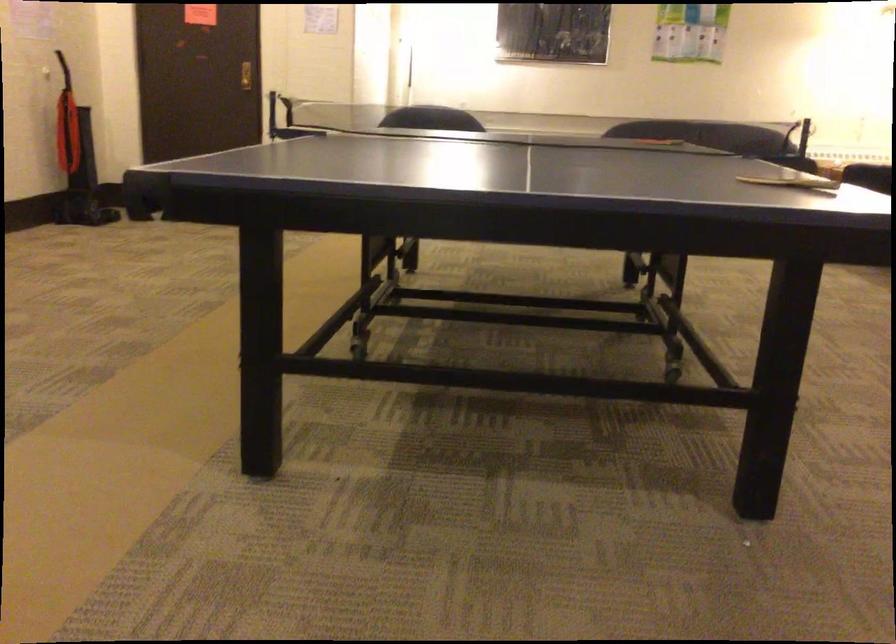
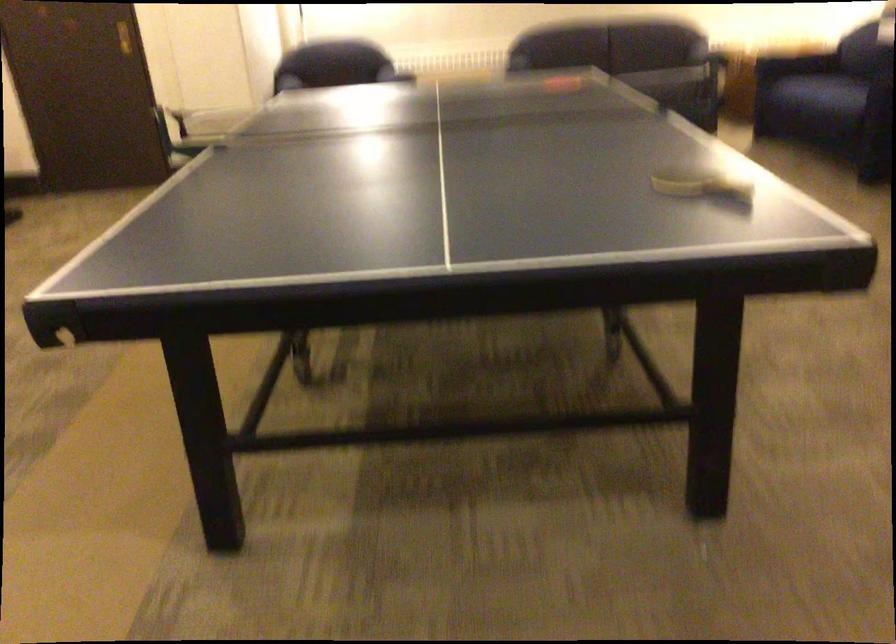
In the second image, find the point that corresponds to pixel 757 128 in the first image.

(668, 82)